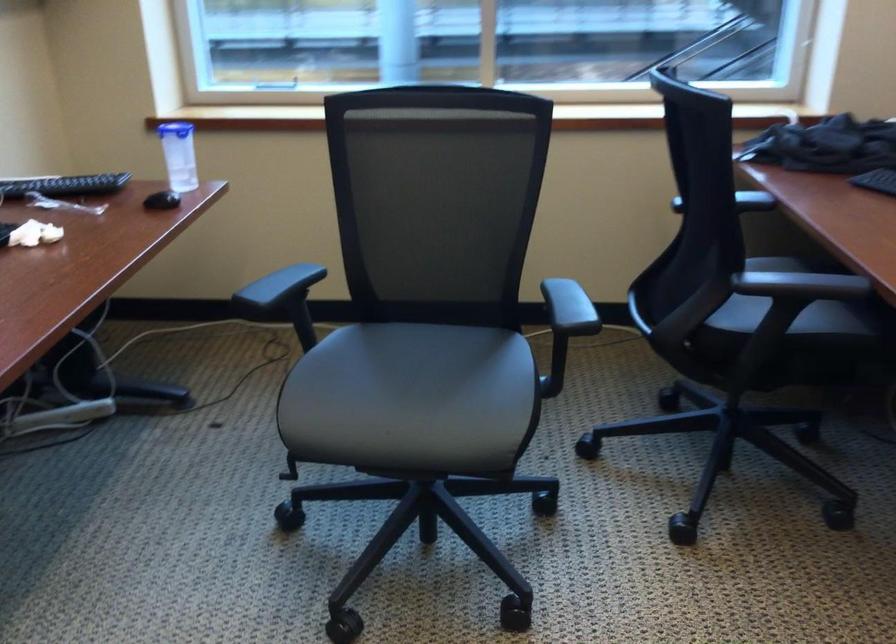
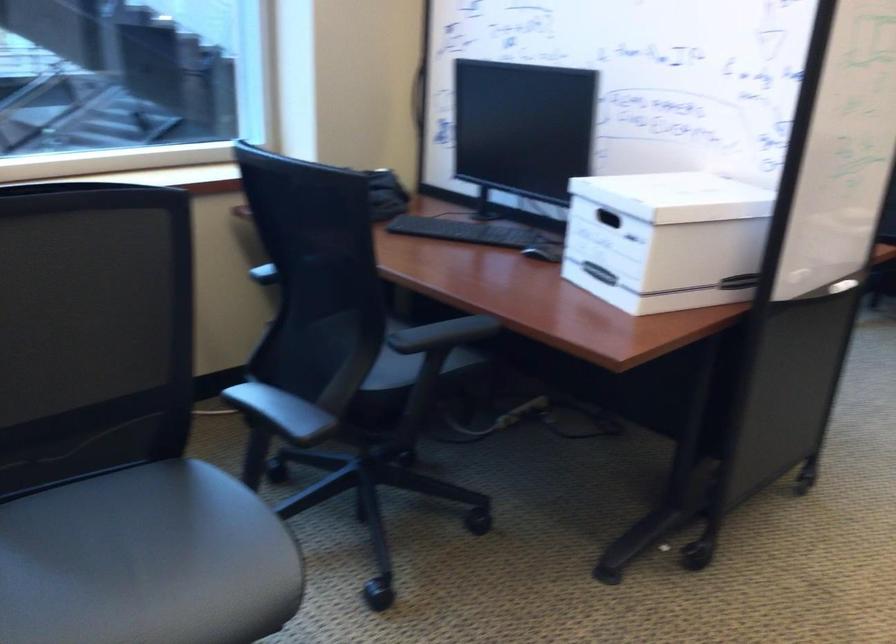
Where in the second image is the point corresponding to point (557, 301) from the first image?

(280, 412)